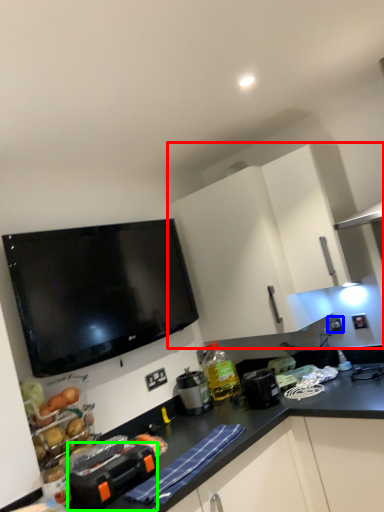
Question: Considering the real-world distances, which object is farthest from cabinetry (highlighted by a red box)? electric outlet (highlighted by a blue box) or appliance (highlighted by a green box)?

Choices:
 (A) electric outlet
 (B) appliance

Answer: (B)